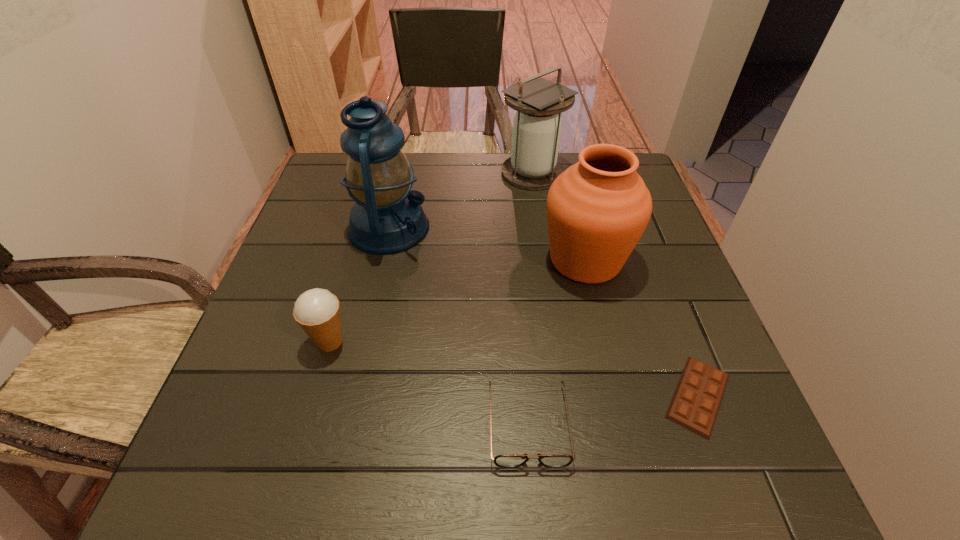
Identify the location of unoccupied area between the urn and the chocolate bar. The height and width of the screenshot is (540, 960). (641, 328).

Locate an element on the screen. free space that is in between the icecream and the shorter lantern is located at coordinates (431, 257).

This screenshot has width=960, height=540. What are the coordinates of `free point between the chocolate bar and the urn` in the screenshot? It's located at (641, 328).

Find the location of a particular element. This screenshot has width=960, height=540. free spot between the fifth tallest object and the tallest object is located at coordinates (459, 326).

Identify the location of object that is the second closest to the taller lantern. The image size is (960, 540). (533, 165).

Identify the location of object that is the closest to the sunglasses. The height and width of the screenshot is (540, 960). (696, 401).

Locate an element on the screen. The width and height of the screenshot is (960, 540). free point that satisfies the following two spatial constraints: 1. on the front side of the farther lantern; 2. on the right side of the chocolate bar is located at coordinates (564, 396).

The width and height of the screenshot is (960, 540). Find the location of `free location that satisfies the following two spatial constraints: 1. on the face of the left lantern; 2. on the left side of the urn`. free location that satisfies the following two spatial constraints: 1. on the face of the left lantern; 2. on the left side of the urn is located at coordinates (382, 260).